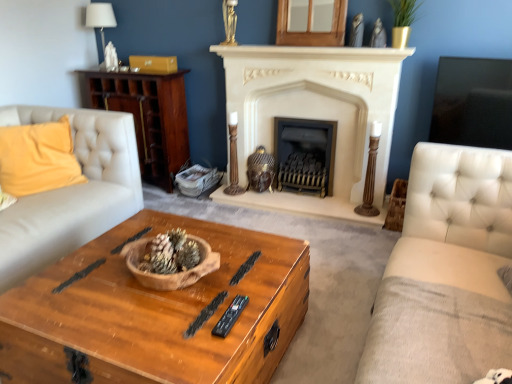
Locate an element on the screen. This screenshot has width=512, height=384. free space above wooden chest at center (from a real-world perspective) is located at coordinates (150, 285).